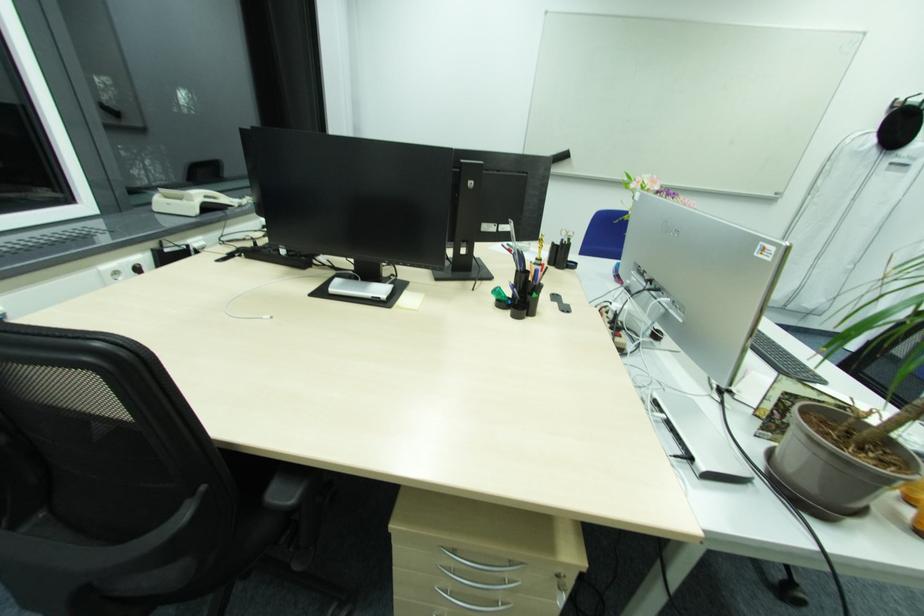
Find where to cut the pair of scissors. Please return your answer as a coordinate pair (x, y).

(516, 249)